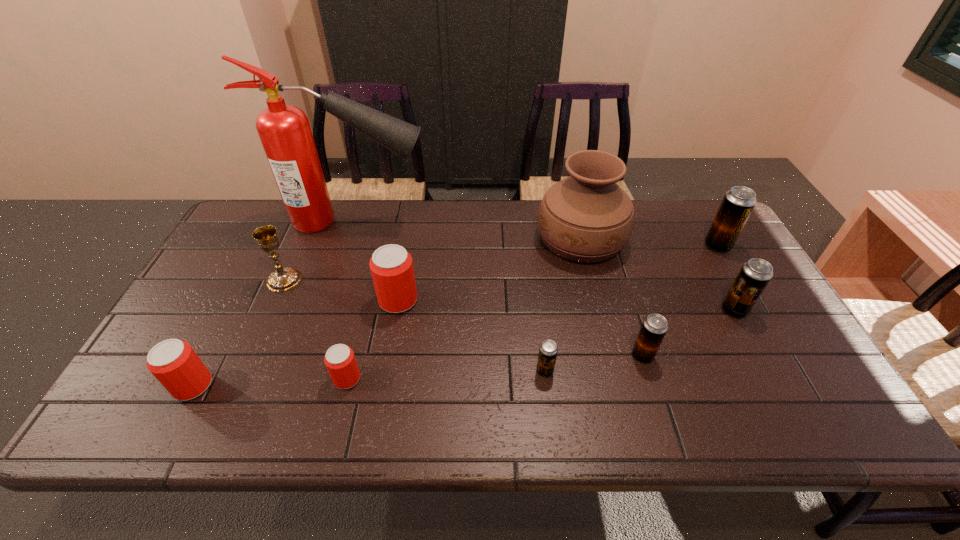
Locate an element on the screen. fire extinguisher is located at coordinates pos(284,130).

Image resolution: width=960 pixels, height=540 pixels. I want to click on red fire extinguisher, so click(x=284, y=130).

At what (x,y) coordinates should I click in order to perform the action: click on urn. Please return your answer as a coordinate pair (x, y). The image size is (960, 540). Looking at the image, I should click on (586, 217).

Find the location of a particular element. The width and height of the screenshot is (960, 540). the farthest black beer can is located at coordinates (738, 203).

Identify the location of the tallest beer can. The image size is (960, 540). (738, 203).

Locate an element on the screen. The width and height of the screenshot is (960, 540). chalice is located at coordinates (283, 279).

You are a GUI agent. You are given a task and a screenshot of the screen. Output one action in this format:
    pyautogui.click(x=<x>, y=<y>)
    Task: Click on the biggest red beer can
    
    Given the screenshot: What is the action you would take?
    pyautogui.click(x=391, y=266)

You are a GUI agent. You are given a task and a screenshot of the screen. Output one action in this format:
    pyautogui.click(x=<x>, y=<y>)
    Task: Click on the rightmost red beer can
    The height and width of the screenshot is (540, 960).
    Given the screenshot: What is the action you would take?
    pyautogui.click(x=391, y=266)

Where is `the second biggest black beer can`? the second biggest black beer can is located at coordinates (755, 274).

This screenshot has width=960, height=540. Identify the location of the leftmost red beer can. click(173, 362).